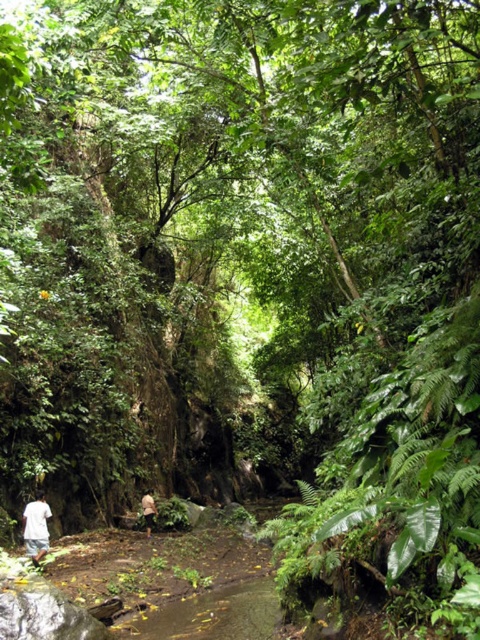
You are a hiker who wants to cross the stream safely. You see a white cotton shirt at lower left and a brown fabric person at center. Which object is closer to the stream?

The white cotton shirt at lower left is to the left of brown fabric person at center, so it is closer to the stream.

From the picture: You are a hiker trying to cross the stream in the forest. You see a white cotton shirt at lower left and a brown fabric person at center. Which item is wider, and how does this affect your path?

The white cotton shirt at lower left is wider than the brown fabric person at center. Since the stream is narrow, you should avoid the wider shirt area to ensure a safer crossing.